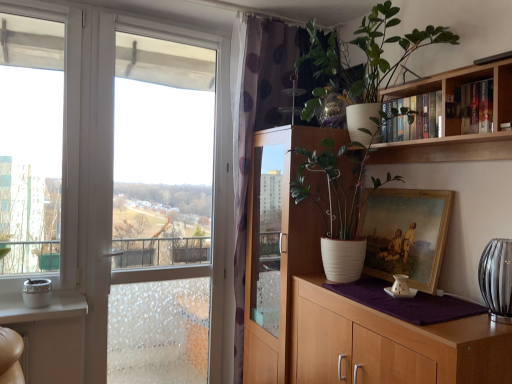
Question: Can you confirm if wooden bookshelf at upper right is wider than translucent glass vase at right?

Choices:
 (A) no
 (B) yes

Answer: (A)

Question: Can we say wooden bookshelf at upper right lies outside translucent glass vase at right?

Choices:
 (A) yes
 (B) no

Answer: (A)

Question: Is wooden bookshelf at upper right to the right of translucent glass vase at right from the viewer's perspective?

Choices:
 (A) yes
 (B) no

Answer: (B)

Question: From a real-world perspective, is wooden bookshelf at upper right below translucent glass vase at right?

Choices:
 (A) yes
 (B) no

Answer: (B)

Question: From the image's perspective, is wooden bookshelf at upper right beneath translucent glass vase at right?

Choices:
 (A) yes
 (B) no

Answer: (B)

Question: Relative to white ceramic pot at upper right, which is the second houseplant from top to bottom, is wooden bookshelf at upper right in front or behind?

Choices:
 (A) front
 (B) behind

Answer: (A)

Question: Is wooden bookshelf at upper right wider or thinner than white ceramic pot at upper right, which ranks as the 1th houseplant in bottom-to-top order?

Choices:
 (A) thin
 (B) wide

Answer: (A)

Question: Considering the relative positions of wooden bookshelf at upper right and white ceramic pot at upper right, which ranks as the 1th houseplant in bottom-to-top order, in the image provided, is wooden bookshelf at upper right to the left or to the right of white ceramic pot at upper right, which ranks as the 1th houseplant in bottom-to-top order,?

Choices:
 (A) right
 (B) left

Answer: (A)

Question: From the image's perspective, is wooden bookshelf at upper right positioned above or below white ceramic pot at upper right, which ranks as the 1th houseplant in bottom-to-top order?

Choices:
 (A) above
 (B) below

Answer: (A)

Question: From a real-world perspective, is translucent glass vase at right positioned above or below clear glass window at left?

Choices:
 (A) below
 (B) above

Answer: (A)

Question: Considering the positions of translucent glass vase at right and clear glass window at left in the image, is translucent glass vase at right taller or shorter than clear glass window at left?

Choices:
 (A) short
 (B) tall

Answer: (A)

Question: In terms of width, does translucent glass vase at right look wider or thinner when compared to clear glass window at left?

Choices:
 (A) wide
 (B) thin

Answer: (A)

Question: Is translucent glass vase at right to the left or to the right of clear glass window at left in the image?

Choices:
 (A) left
 (B) right

Answer: (B)

Question: Is point coord(320,256) closer or farther from the camera than point coord(410,192)?

Choices:
 (A) farther
 (B) closer

Answer: (A)

Question: In the image, is white wood cabinet at right, which is the 1th cabinetry in back-to-front order, positioned in front of or behind gold-framed painting at right?

Choices:
 (A) front
 (B) behind

Answer: (B)